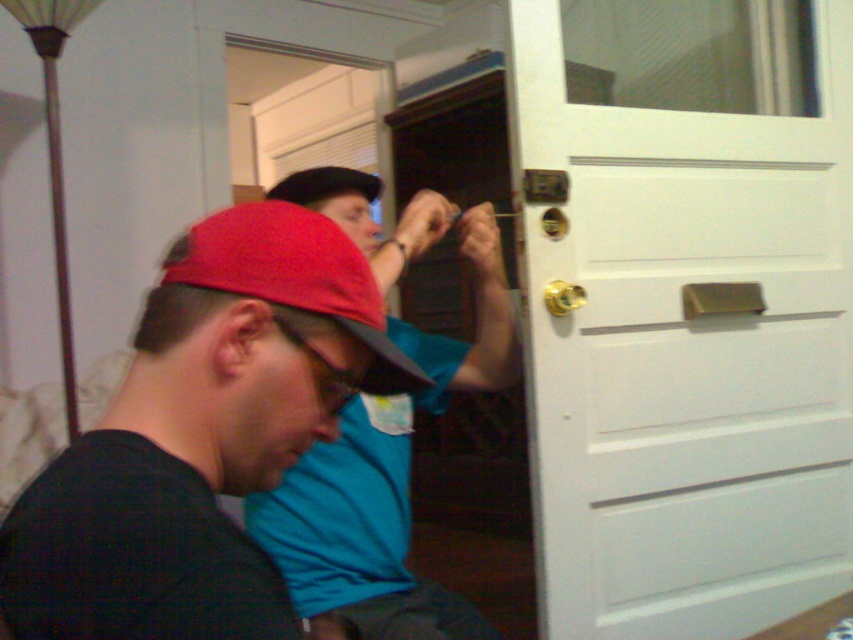
Between white painted wood door at center right and blue fabric shirt at center, which one appears on the left side from the viewer's perspective?

blue fabric shirt at center is more to the left.

Measure the distance between point (782, 573) and camera.

Point (782, 573) is 5.92 feet away from camera.

Describe the element at coordinates (682, 308) in the screenshot. I see `white painted wood door at center right` at that location.

You are a GUI agent. You are given a task and a screenshot of the screen. Output one action in this format:
    pyautogui.click(x=<x>, y=<y>)
    Task: Click on the white painted wood door at center right
    The height and width of the screenshot is (640, 853).
    Given the screenshot: What is the action you would take?
    pyautogui.click(x=682, y=308)

Looking at this image, can you confirm if red fabric cap at center is bigger than gold metallic door handle at center right?

Yes, red fabric cap at center is bigger than gold metallic door handle at center right.

Can you confirm if red fabric cap at center is thinner than gold metallic door handle at center right?

Incorrect, red fabric cap at center's width is not less than gold metallic door handle at center right's.

Who is more distant from viewer, (368, 272) or (544, 291)?

Positioned behind is point (544, 291).

Find the location of a particular element. The height and width of the screenshot is (640, 853). red fabric cap at center is located at coordinates (296, 276).

Is white painted wood door at center right behind gold metallic door handle at center?

No, white painted wood door at center right is closer to the viewer.

Does white painted wood door at center right appear on the left side of gold metallic door handle at center?

Correct, you'll find white painted wood door at center right to the left of gold metallic door handle at center.

Is point (691, 515) positioned before point (727, 284)?

Yes, point (691, 515) is closer to viewer.

Identify the location of white painted wood door at center right. Image resolution: width=853 pixels, height=640 pixels. (682, 308).